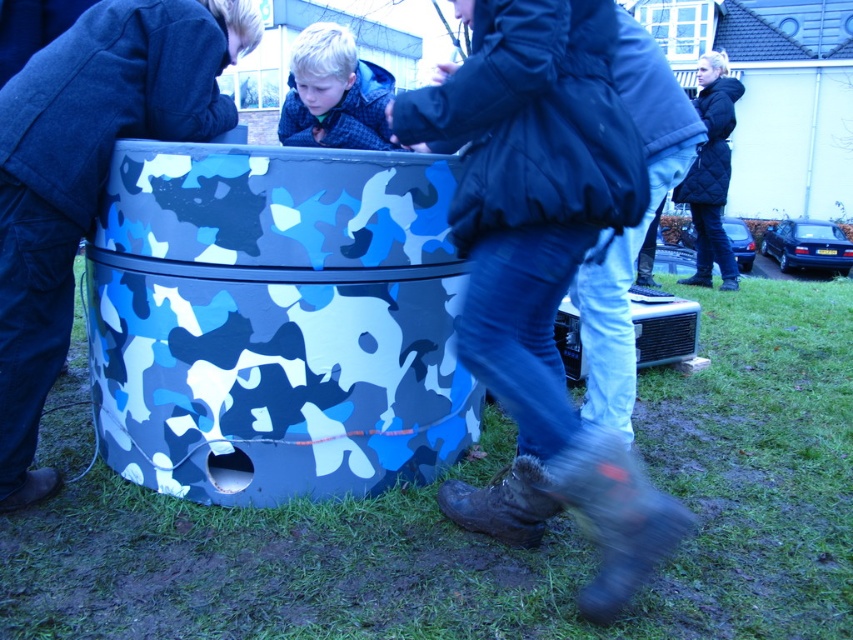
Question: Is dark blue puffy jacket at center positioned behind blonde hair at center?

Choices:
 (A) no
 (B) yes

Answer: (A)

Question: Which point is closer to the camera?

Choices:
 (A) dark blue puffy jacket at center
 (B) quilted black jacket at upper right

Answer: (A)

Question: Can you confirm if dark blue puffy jacket at center is wider than blonde hair at center?

Choices:
 (A) no
 (B) yes

Answer: (B)

Question: Among these objects, which one is nearest to the camera?

Choices:
 (A) blonde hair at center
 (B) quilted black jacket at upper right
 (C) dark blue puffy jacket at center

Answer: (C)

Question: Which of the following is the farthest from the observer?

Choices:
 (A) (714, 122)
 (B) (606, 44)
 (C) (285, 120)

Answer: (A)

Question: Can you confirm if blonde hair at center is positioned to the right of quilted black jacket at upper right?

Choices:
 (A) no
 (B) yes

Answer: (A)